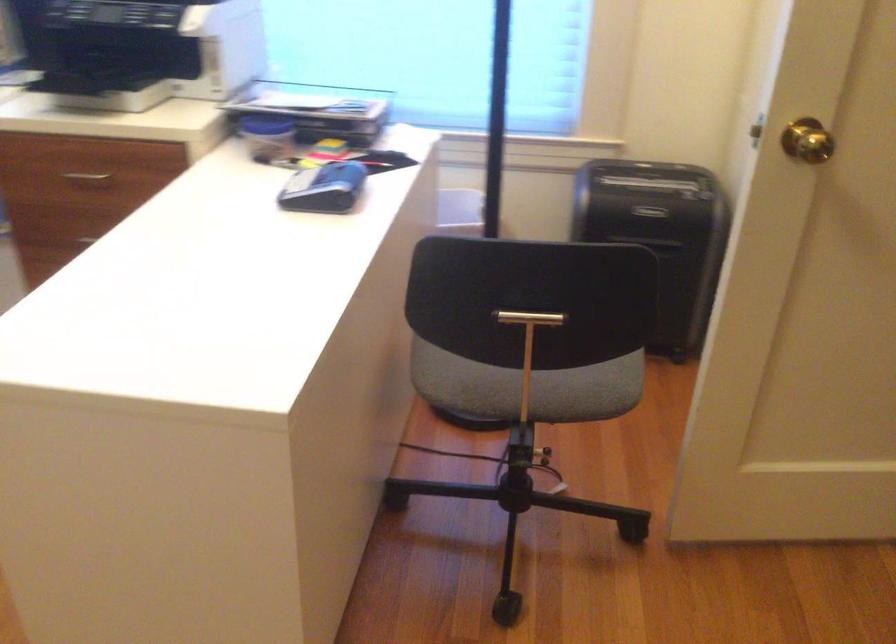
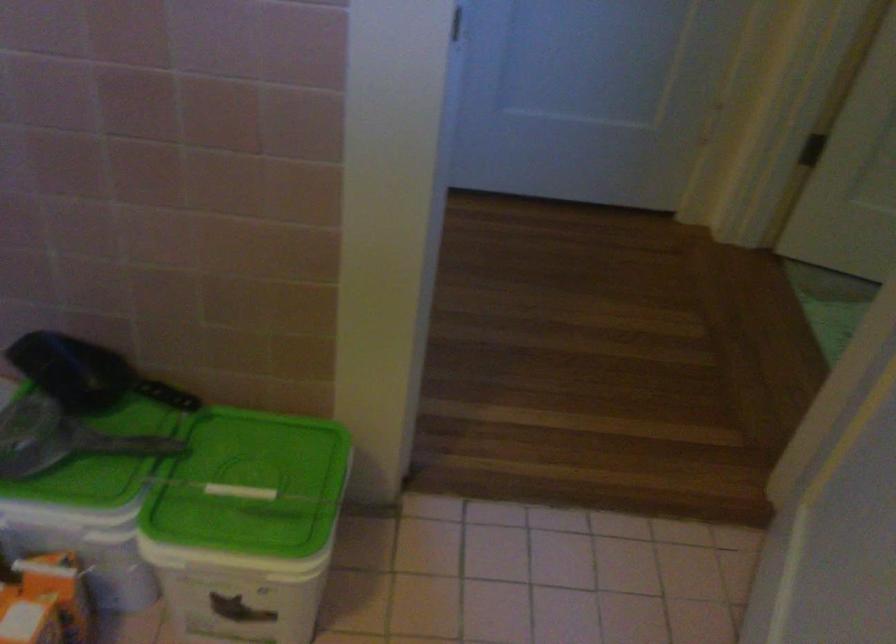
Question: Which direction would the cameraman need to move to produce the second image? Reply with the corresponding letter.

Choices:
 (A) Left
 (B) Right
 (C) Forward
 (D) Backward

Answer: (B)